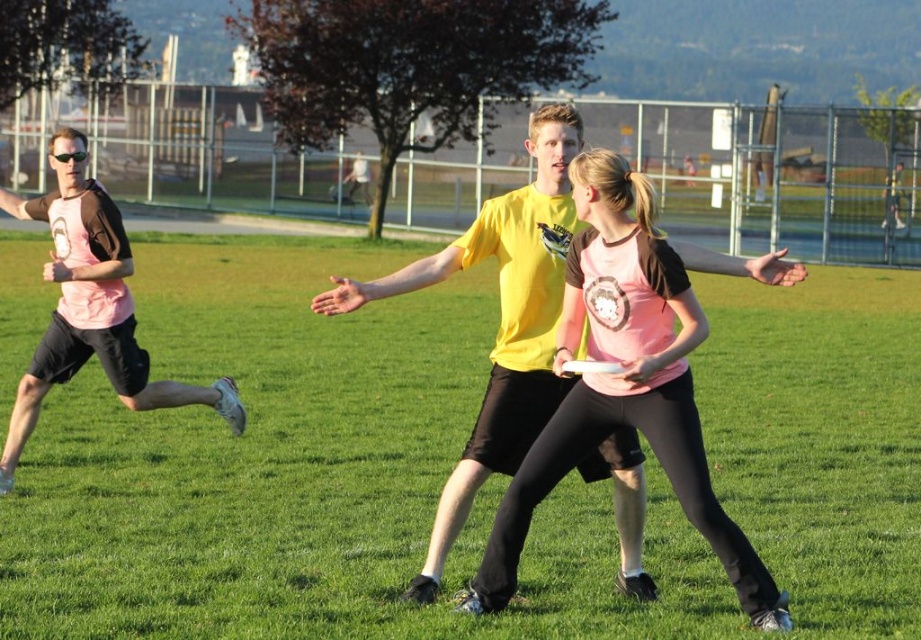
Based on the coordinates provided in the scene description, where exactly is the green grass at center located?

The green grass at center is located at point (x=309, y=474).

You are a player in the ultimate frisbee game and need to pass the frisbee to the pink matte jersey at center. Based on their position, where should you aim to throw the frisbee?

The pink matte jersey at center is located at point (624, 385), so you should aim your throw towards those coordinates to reach them.